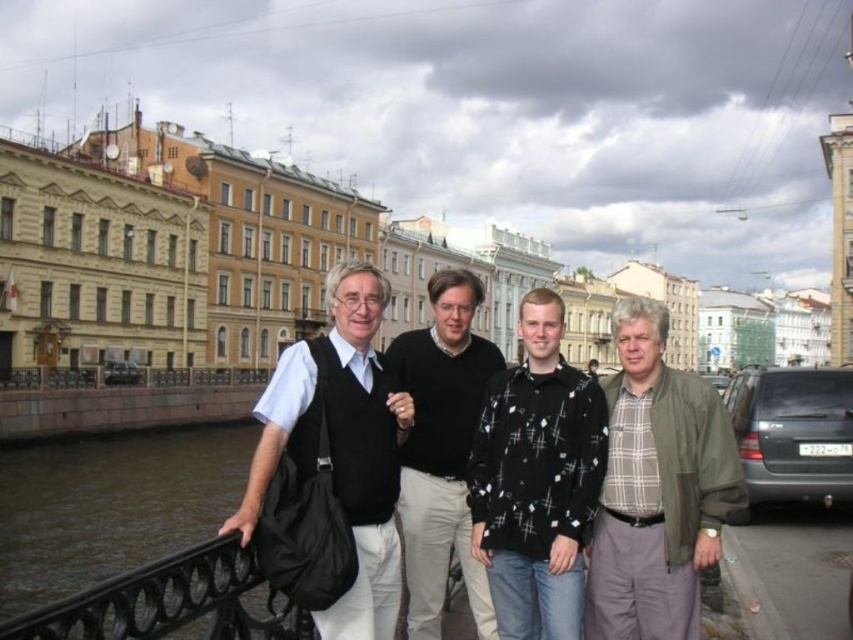
Is point (386, 406) farther from camera compared to point (173, 620)?

Yes, point (386, 406) is farther from viewer.

Does matte black vest at center have a lesser width compared to black wrought iron railing at lower left?

In fact, matte black vest at center might be wider than black wrought iron railing at lower left.

Who is more forward, [373,378] or [231,570]?

Point [231,570]

Where is `matte black vest at center`? Image resolution: width=853 pixels, height=640 pixels. matte black vest at center is located at coordinates (341, 445).

Does black sweater at center appear on the right side of black wrought iron railing at lower left?

Correct, you'll find black sweater at center to the right of black wrought iron railing at lower left.

Which is in front, point (436, 502) or point (229, 570)?

Point (229, 570) is in front.

Does point (402, 520) lie behind point (50, 636)?

Yes.

In order to click on black sweater at center in this screenshot , I will do `click(440, 449)`.

In the scene shown: Measure the distance between plaid cotton shirt at right and camera.

plaid cotton shirt at right and camera are 120.16 feet apart from each other.

Consider the image. Who is positioned more to the left, plaid cotton shirt at right or matte black vest at center?

matte black vest at center

Who is more distant from viewer, (619, 406) or (358, 598)?

Point (619, 406)

In order to click on plaid cotton shirt at right in this screenshot , I will do `click(657, 488)`.